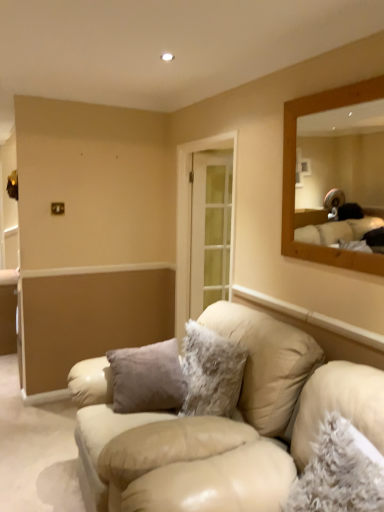
Question: Relative to beige leather couch at center, is fuzzy gray pillow at lower right, which is the second pillow from back to front, in front or behind?

Choices:
 (A) behind
 (B) front

Answer: (B)

Question: Do you think fuzzy gray pillow at lower right, positioned as the 1th pillow in right-to-left order, is within beige leather couch at center, or outside of it?

Choices:
 (A) outside
 (B) inside

Answer: (A)

Question: Which object is positioned farthest from the beige leather couch at center?

Choices:
 (A) fuzzy gray pillow at lower right, positioned as the 1th pillow in right-to-left order
 (B) fuzzy white pillow at center, the second pillow positioned from the right

Answer: (A)

Question: Considering the real-world distances, which object is farthest from the beige leather couch at center?

Choices:
 (A) fuzzy gray pillow at lower right, which is the second pillow from back to front
 (B) fuzzy white pillow at center, the second pillow positioned from the right

Answer: (A)